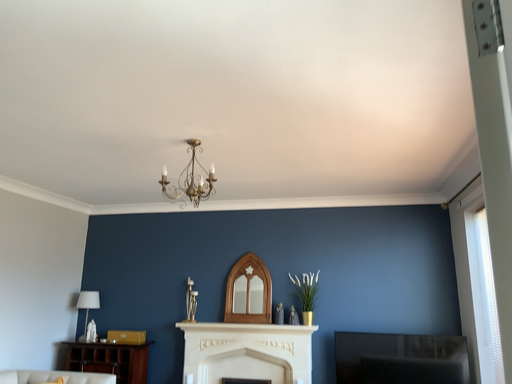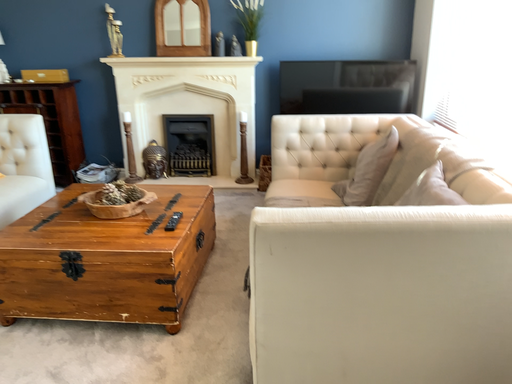
Question: Which way did the camera rotate in the video?

Choices:
 (A) rotated left
 (B) rotated right

Answer: (B)